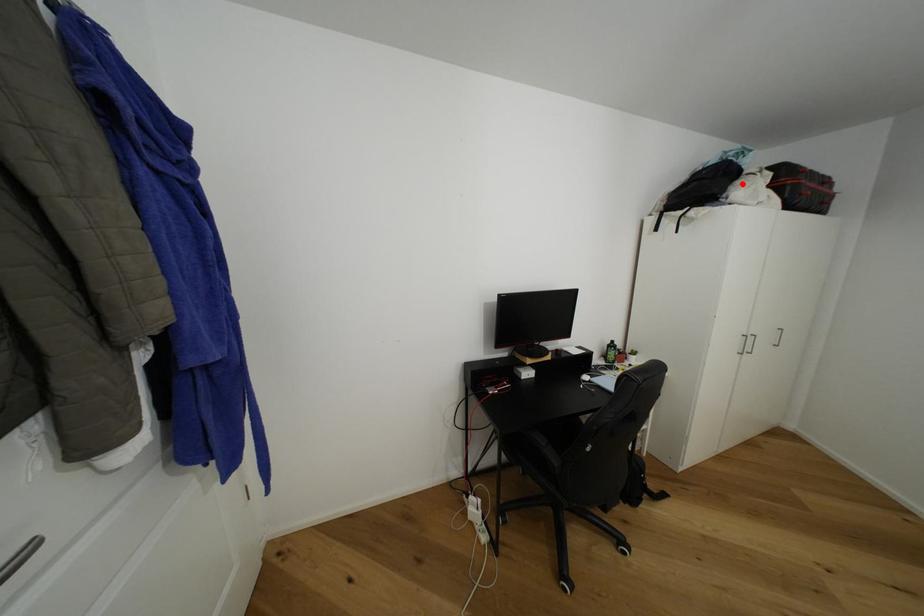
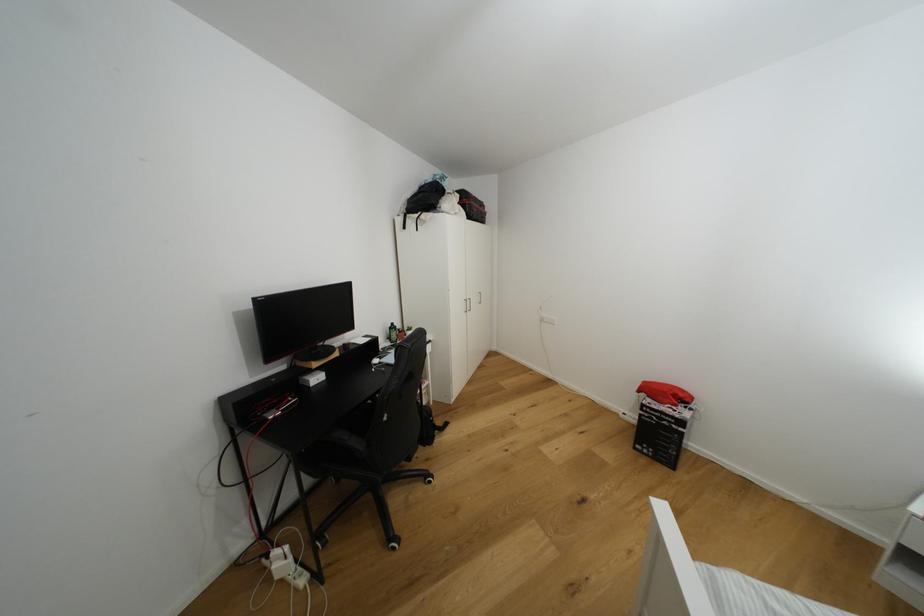
In the second image, find the point that corresponds to the highlighted location in the first image.

(448, 199)